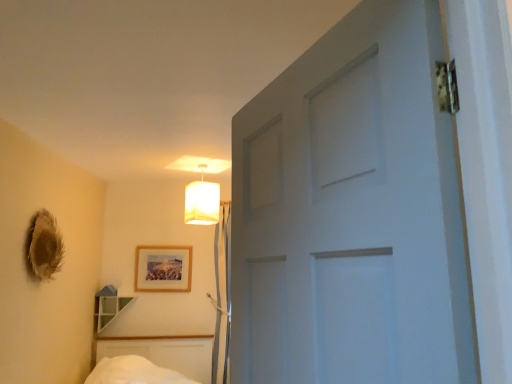
Question: Does matte white lampshade at upper center turn towards wooden picture frame at center?

Choices:
 (A) yes
 (B) no

Answer: (B)

Question: Can you confirm if matte white lampshade at upper center is taller than wooden picture frame at center?

Choices:
 (A) no
 (B) yes

Answer: (B)

Question: Is matte white lampshade at upper center to the right of wooden picture frame at center from the viewer's perspective?

Choices:
 (A) no
 (B) yes

Answer: (B)

Question: From the image's perspective, is matte white lampshade at upper center on wooden picture frame at center?

Choices:
 (A) yes
 (B) no

Answer: (A)

Question: Is matte white lampshade at upper center shorter than wooden picture frame at center?

Choices:
 (A) yes
 (B) no

Answer: (B)

Question: Does matte white lampshade at upper center have a lesser width compared to wooden picture frame at center?

Choices:
 (A) yes
 (B) no

Answer: (B)

Question: Is wooden picture frame at center at the right side of clear glass shelf at lower left?

Choices:
 (A) no
 (B) yes

Answer: (B)

Question: Considering the relative sizes of wooden picture frame at center and clear glass shelf at lower left in the image provided, is wooden picture frame at center wider than clear glass shelf at lower left?

Choices:
 (A) yes
 (B) no

Answer: (B)

Question: Does wooden picture frame at center have a smaller size compared to clear glass shelf at lower left?

Choices:
 (A) no
 (B) yes

Answer: (B)

Question: Is wooden picture frame at center closer to camera compared to clear glass shelf at lower left?

Choices:
 (A) no
 (B) yes

Answer: (A)

Question: From a real-world perspective, is wooden picture frame at center on clear glass shelf at lower left?

Choices:
 (A) yes
 (B) no

Answer: (A)

Question: Is wooden picture frame at center far away from clear glass shelf at lower left?

Choices:
 (A) no
 (B) yes

Answer: (A)

Question: Is clear glass shelf at lower left facing away from wooden picture frame at center?

Choices:
 (A) yes
 (B) no

Answer: (B)